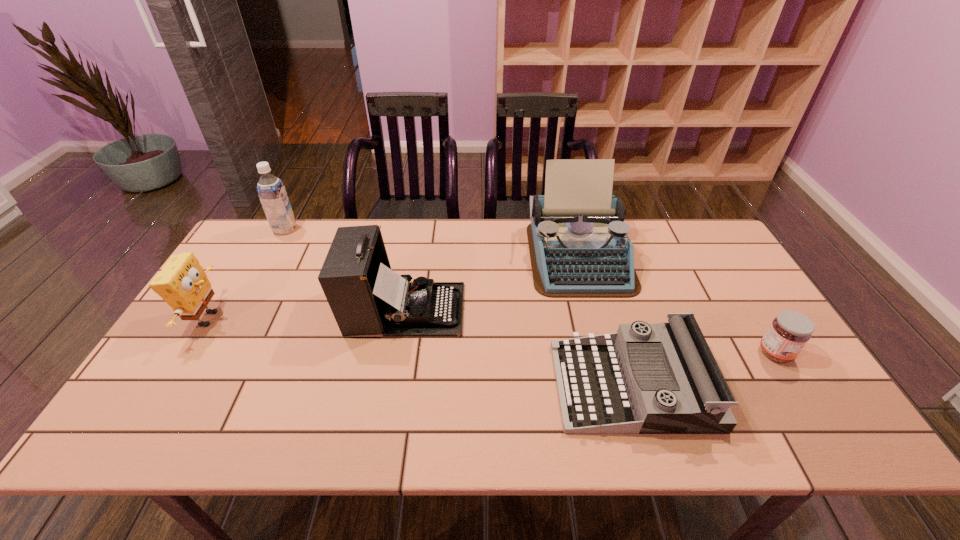
I want to click on free region located 0.120m on the typing side of the nearest typewriter, so click(x=507, y=386).

At what (x,y) coordinates should I click in order to perform the action: click on free space located 0.310m on the left of the rightmost object. Please return your answer as a coordinate pair (x, y). This screenshot has width=960, height=540. Looking at the image, I should click on (637, 353).

Locate an element on the screen. The height and width of the screenshot is (540, 960). soya milk situated at the far edge is located at coordinates (271, 191).

I want to click on typewriter located in the far edge section of the desktop, so click(x=579, y=247).

Where is `object at the near edge`? object at the near edge is located at coordinates (662, 378).

At what (x,y) coordinates should I click in order to perform the action: click on soya milk that is at the left edge. Please return your answer as a coordinate pair (x, y). This screenshot has width=960, height=540. Looking at the image, I should click on (271, 191).

Identify the location of sponge at the left edge. (182, 283).

Locate an element on the screen. object present at the right edge is located at coordinates (789, 332).

Find the location of a particular element. object that is at the far left corner is located at coordinates (271, 191).

Locate an element on the screen. This screenshot has height=540, width=960. blank space at the far edge of the desktop is located at coordinates (646, 259).